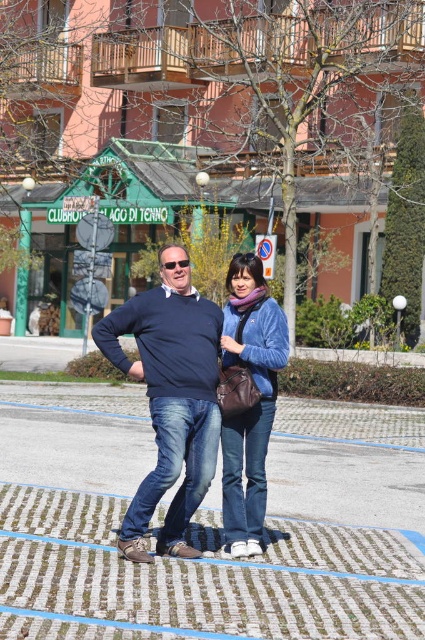
Question: Is matte blue sweater at center smaller than matte brown leather jacket at center?

Choices:
 (A) no
 (B) yes

Answer: (A)

Question: Does matte blue sweater at center appear over matte plastic goggles at center?

Choices:
 (A) yes
 (B) no

Answer: (B)

Question: Which of these objects is positioned closest to the matte brown leather jacket at center?

Choices:
 (A) matte plastic goggles at center
 (B) matte blue sweater at center

Answer: (B)

Question: Is matte blue sweater at center wider than matte brown leather jacket at center?

Choices:
 (A) yes
 (B) no

Answer: (A)

Question: Considering the real-world distances, which object is closest to the matte brown leather jacket at center?

Choices:
 (A) matte blue sweater at center
 (B) matte plastic goggles at center

Answer: (A)

Question: Which point appears closest to the camera in this image?

Choices:
 (A) (268, 342)
 (B) (138, 528)

Answer: (B)